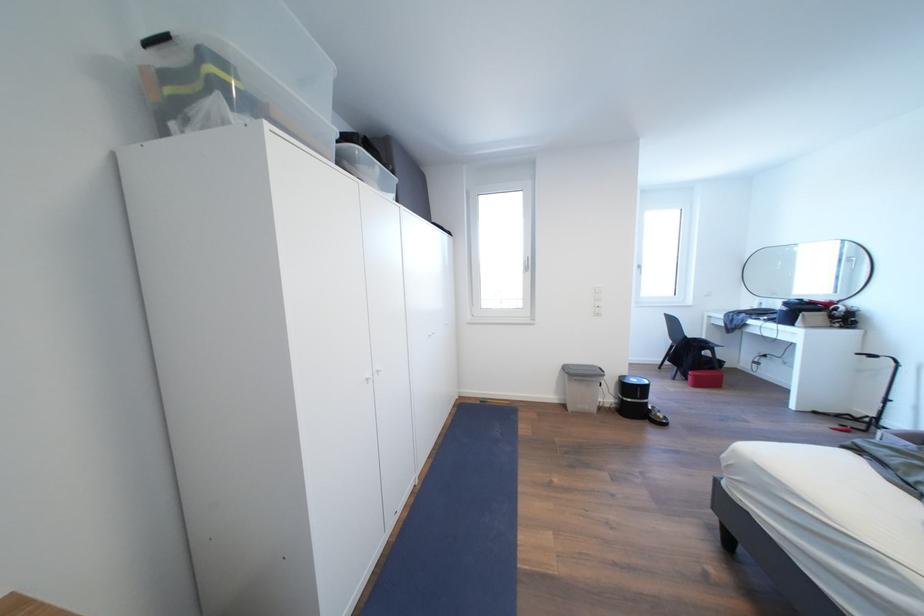
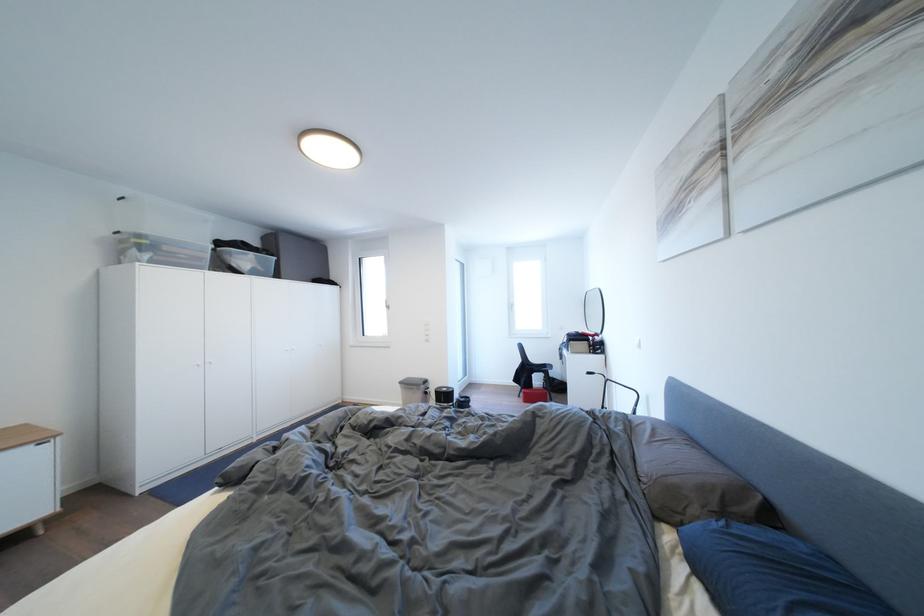
The point at (229, 68) is marked in the first image. Where is the corresponding point in the second image?

(149, 241)